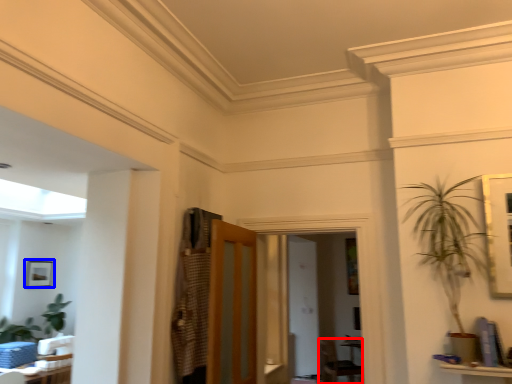
Question: Among these objects, which one is nearest to the camera, armchair (highlighted by a red box) or picture frame (highlighted by a blue box)?

Choices:
 (A) armchair
 (B) picture frame

Answer: (B)